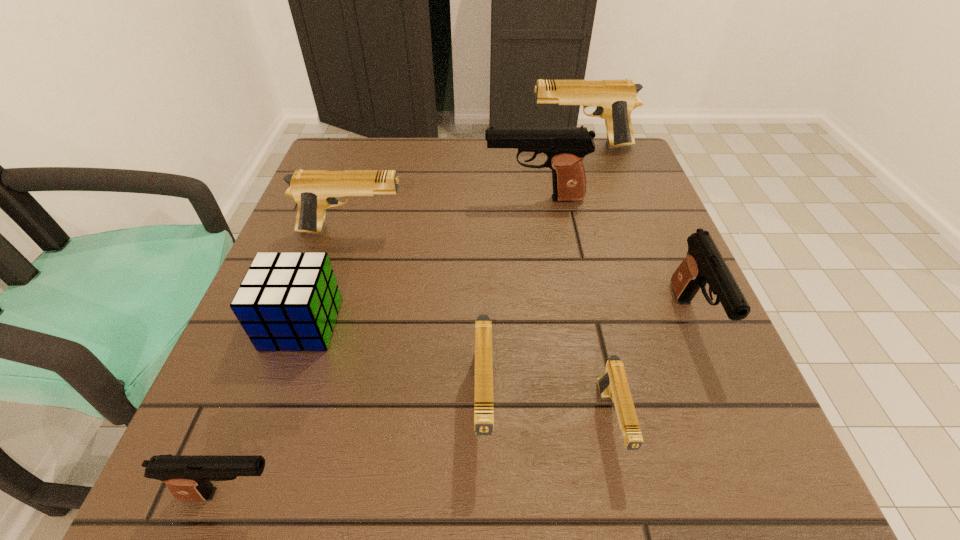
Locate an element on the screen. The height and width of the screenshot is (540, 960). the seventh nearest object is located at coordinates (565, 147).

Identify the location of the second black pistol from left to right. tap(565, 147).

Identify the location of the farthest pistol. The height and width of the screenshot is (540, 960). (615, 99).

This screenshot has width=960, height=540. I want to click on the biggest tan pistol, so click(615, 99).

Locate an element on the screen. This screenshot has height=540, width=960. the third farthest object is located at coordinates (314, 190).

You are a GUI agent. You are given a task and a screenshot of the screen. Output one action in this format:
    pyautogui.click(x=<x>, y=<y>)
    Task: Click on the second biggest tan pistol
    
    Given the screenshot: What is the action you would take?
    pyautogui.click(x=314, y=190)

Locate an element on the screen. The image size is (960, 540). the second farthest black pistol is located at coordinates (704, 263).

Locate an element on the screen. This screenshot has height=540, width=960. the second biggest black pistol is located at coordinates (704, 263).

This screenshot has width=960, height=540. I want to click on cube, so click(x=289, y=301).

Where is `the second smallest tan pistol`? the second smallest tan pistol is located at coordinates (483, 380).